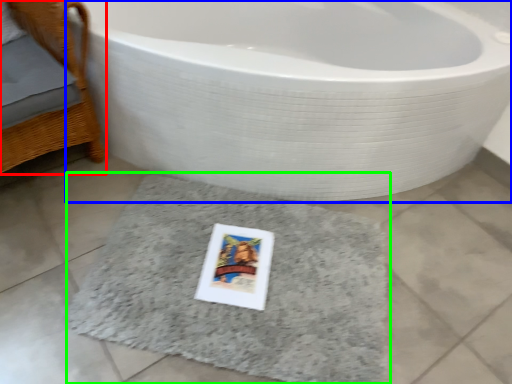
Question: Based on their relative distances, which object is farther from furniture (highlighted by a red box)? Choose from bathtub (highlighted by a blue box) and bath mat (highlighted by a green box).

Choices:
 (A) bathtub
 (B) bath mat

Answer: (B)